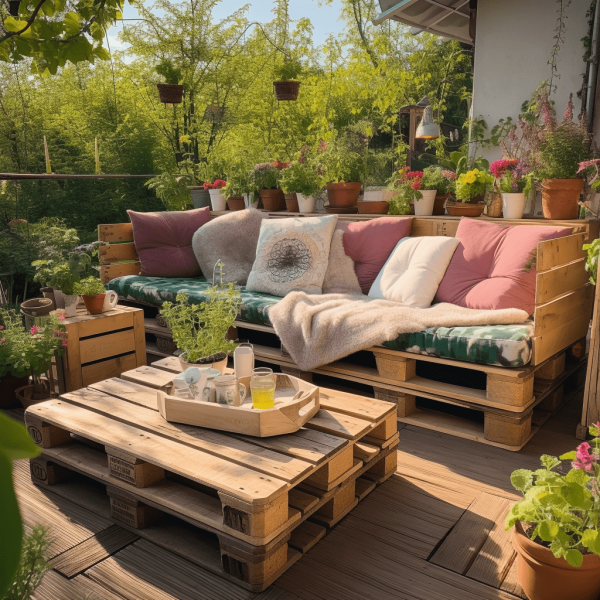
Find the location of `wooden tray handle hole`. wooden tray handle hole is located at coordinates (307, 407).